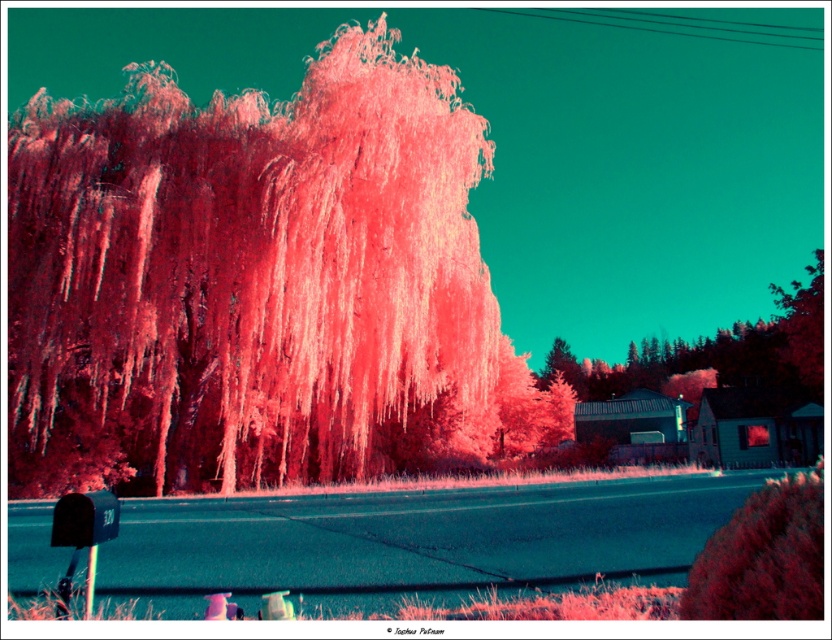
You are a postal worker delivering mail to the mailbox with the number 320. You notice the pink matte tree at center and the smooth red tree at lower right. Which tree is closer to you as you approach the mailbox?

The pink matte tree at center is closer to you because the smooth red tree at lower right is behind it.

You are standing at the mailbox with the number 320 on the left side of the image. You see two points in the scene labeled as point (x=176, y=420) and point (x=758, y=593). Which point is closer to you?

Point (x=758, y=593) is closer to you because point (x=176, y=420) is behind point (x=758, y=593).

You are a delivery person who needs to place a package between the pink matte tree at center and the smooth red tree at lower right. The package requires a minimum of 50 feet of space to be placed safely. Can you place the package between them?

The distance between the pink matte tree at center and the smooth red tree at lower right is 75.92 feet, which is more than the required 50 feet. Therefore, the package can be safely placed between them.